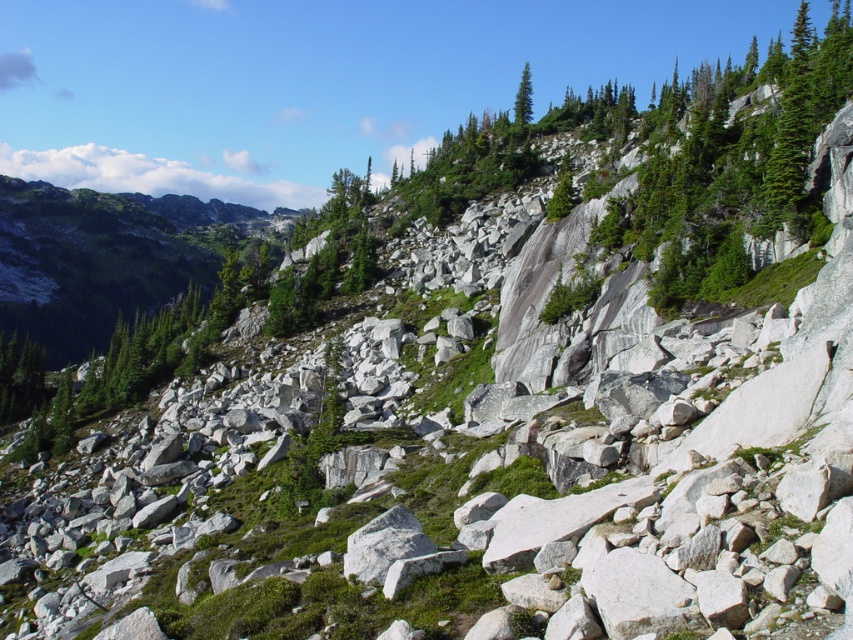
Does green mossy rock at upper left appear on the right side of green textured tree at upper center?

In fact, green mossy rock at upper left is to the left of green textured tree at upper center.

Does green mossy rock at upper left appear over green textured tree at upper center?

Actually, green mossy rock at upper left is below green textured tree at upper center.

Based on the photo, who is more forward, (154, 200) or (527, 77)?

Point (527, 77) is in front.

Locate an element on the screen. The height and width of the screenshot is (640, 853). green mossy rock at upper left is located at coordinates (102, 259).